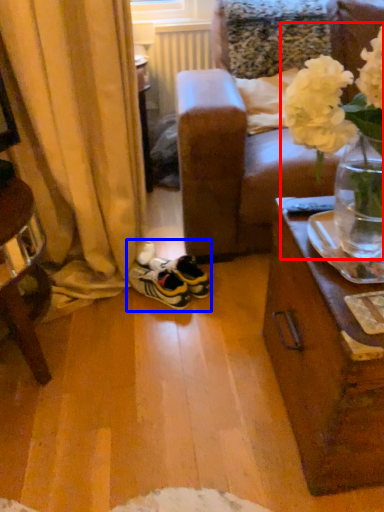
Question: Among these objects, which one is farthest to the camera, floral arrangement (highlighted by a red box) or footwear (highlighted by a blue box)?

Choices:
 (A) floral arrangement
 (B) footwear

Answer: (B)